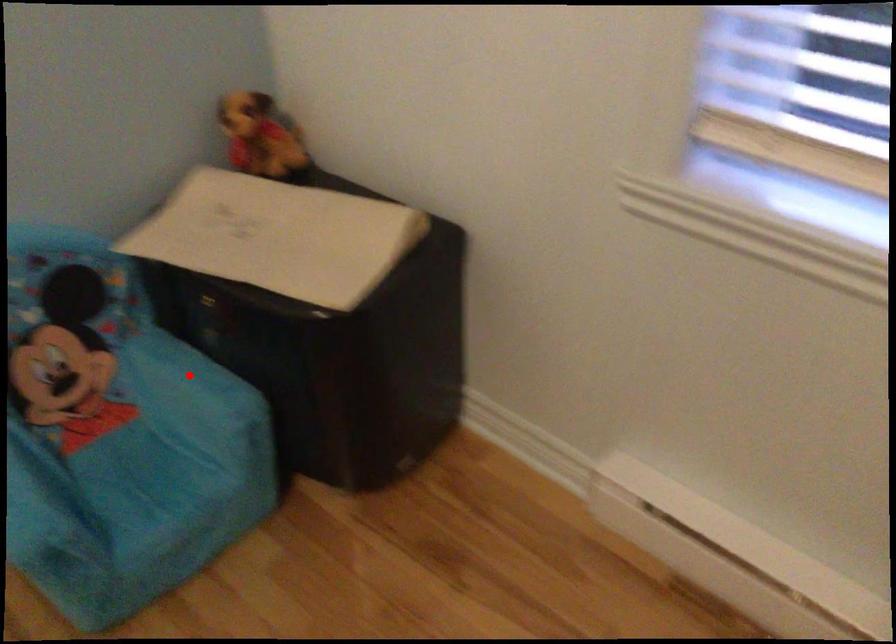
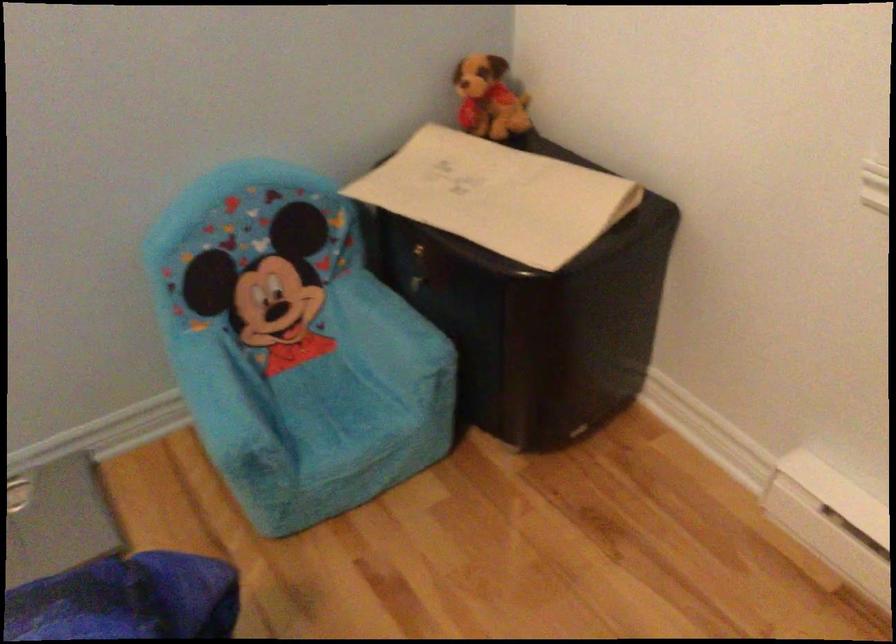
Locate, in the second image, the point that corresponds to the highlighted location in the first image.

(389, 316)